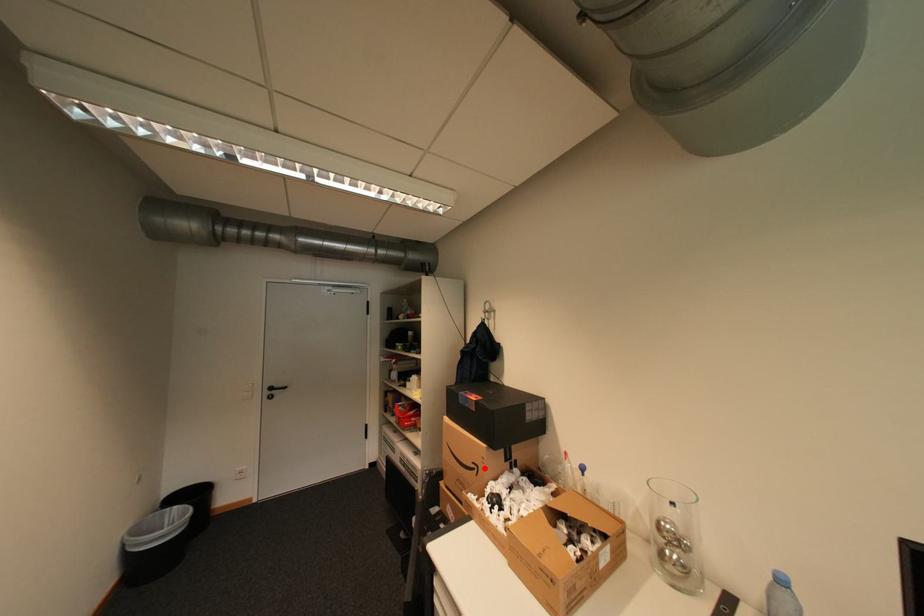
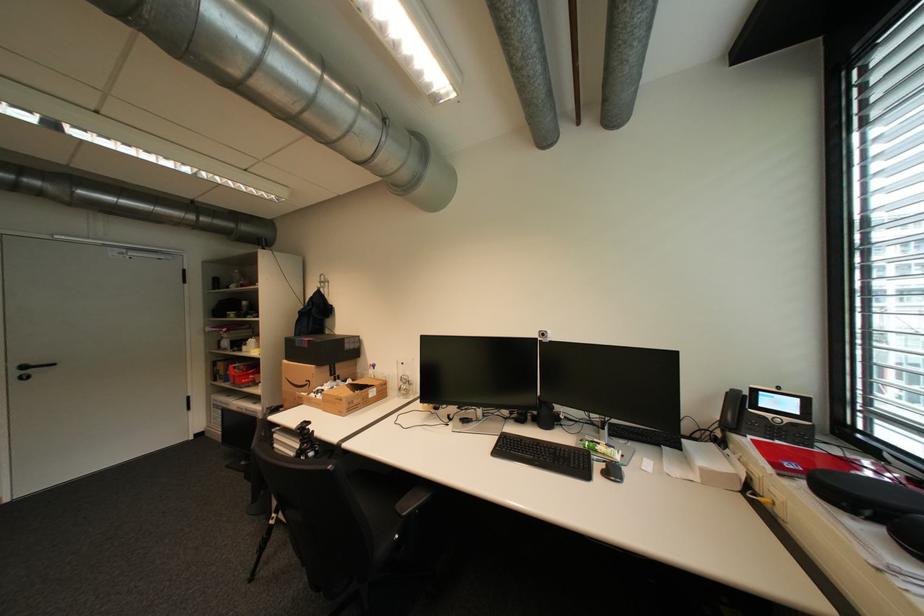
Find the pixel in the second image that matches the highlighted location in the first image.

(317, 383)